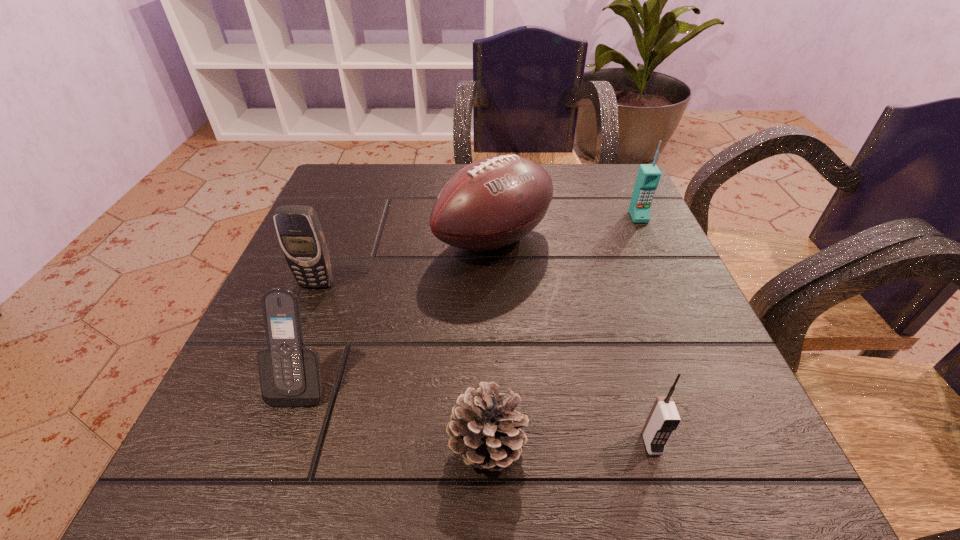
Image resolution: width=960 pixels, height=540 pixels. I want to click on free spot between the third farthest cellular telephone and the fourth nearest object, so click(309, 333).

The height and width of the screenshot is (540, 960). Identify the location of vacant region between the third nearest object and the football (American). (397, 312).

Find the location of a particular element. The height and width of the screenshot is (540, 960). empty space that is in between the fifth object from left to right and the farthest cellular telephone is located at coordinates (645, 330).

Where is `vacant area that lies between the football (American) and the second farthest cellular telephone`? The width and height of the screenshot is (960, 540). vacant area that lies between the football (American) and the second farthest cellular telephone is located at coordinates (405, 262).

The image size is (960, 540). I want to click on vacant region between the pinecone and the third farthest cellular telephone, so click(395, 414).

You are a GUI agent. You are given a task and a screenshot of the screen. Output one action in this format:
    pyautogui.click(x=<x>, y=<y>)
    Task: Click on the fifth closest object relative to the football (American)
    Image resolution: width=960 pixels, height=540 pixels.
    Given the screenshot: What is the action you would take?
    pyautogui.click(x=663, y=419)

Find the location of a particular element. The height and width of the screenshot is (540, 960). object that is the closest to the pinecone is located at coordinates (663, 419).

Point out which cellular telephone is positioned as the nearest to the football (American). Please provide its 2D coordinates. Your answer should be formatted as a tuple, i.e. [(x, y)], where the tuple contains the x and y coordinates of a point satisfying the conditions above.

[(300, 234)]

Select which cellular telephone appears as the closest to the third nearest cellular telephone. Please provide its 2D coordinates. Your answer should be formatted as a tuple, i.e. [(x, y)], where the tuple contains the x and y coordinates of a point satisfying the conditions above.

[(290, 376)]